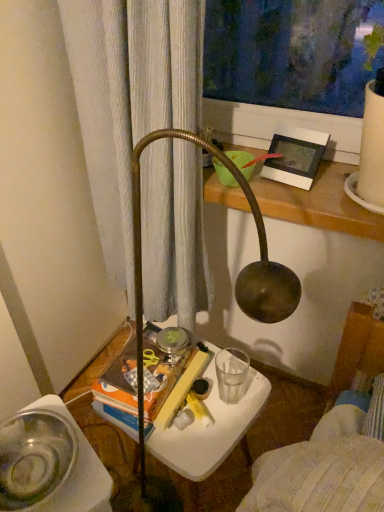
The height and width of the screenshot is (512, 384). What are the coordinates of `free point below metallic silver bowl at lower left (from a real-world perspective)` in the screenshot? It's located at (35, 477).